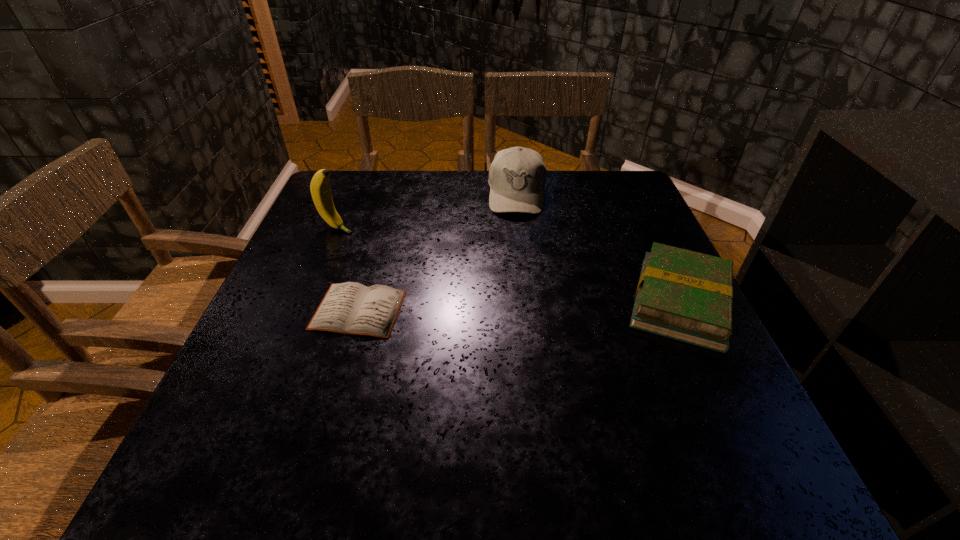
Where is `the shortest object`? the shortest object is located at coordinates (349, 308).

The width and height of the screenshot is (960, 540). I want to click on the second shortest object, so click(684, 295).

Identify the location of book. This screenshot has height=540, width=960. (684, 295).

The image size is (960, 540). In order to click on the third object from left to right in this screenshot , I will do `click(517, 176)`.

Where is `the second tallest object`? The height and width of the screenshot is (540, 960). the second tallest object is located at coordinates (517, 176).

Identify the location of the third nearest object. (320, 190).

This screenshot has height=540, width=960. Find the location of `the tallest object`. the tallest object is located at coordinates (320, 190).

Identify the location of vacant region located on the right of the shortest object. pos(587,310).

Where is `vacant region located on the left of the book`? The height and width of the screenshot is (540, 960). vacant region located on the left of the book is located at coordinates (460, 302).

Find the location of a particular element. The image size is (960, 540). free space located 0.060m on the front-facing side of the third object from left to right is located at coordinates (516, 232).